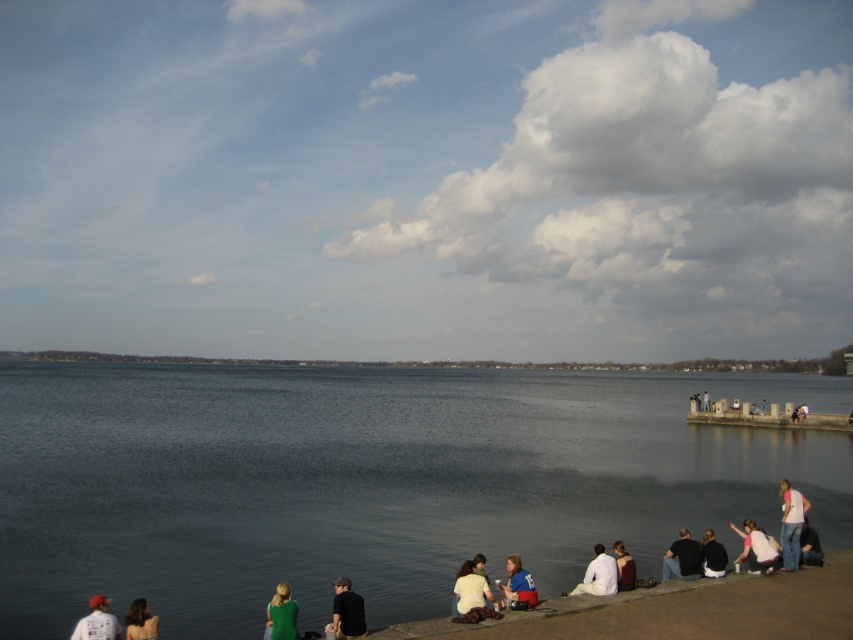
You are standing at the edge of the walkway and want to greet both the dark blue shirt at lower center and the green fabric shirt at lower left. Which person should you approach first based on their proximity to you?

You should approach the dark blue shirt at lower center first because it is closer to you than the green fabric shirt at lower left.

You are standing on the walkway and notice two items on the ground near the water. The dark blue jeans at lower right and the light brown leather jacket at lower center. Which item is closer to the water?

The dark blue jeans at lower right is below light brown leather jacket at lower center, so it is closer to the water.

You are a photographer trying to capture a candid shot of the people at the lakeside. You have a camera with a 120mm lens that has a field of view of 60 degrees. You are standing at the edge of the walkway. The matte white cap at lower left and the dark gray sweater at lower right are both in your frame. To ensure both are fully visible, which object should you focus on to maintain the composition without moving the camera?

You should focus on the matte white cap at lower left because it might be wider than the dark gray sweater at lower right, so keeping it centered will ensure both objects remain within the 60 degree field of view.